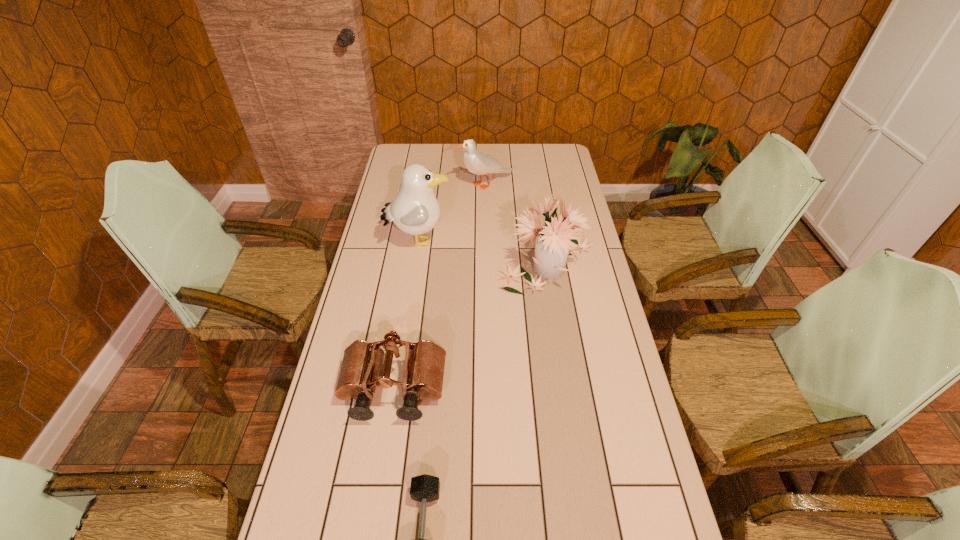
Locate an element on the screen. This screenshot has height=540, width=960. the nearer gull is located at coordinates (415, 210).

Identify the location of the taller gull. The image size is (960, 540). (415, 210).

Locate an element on the screen. bouquet is located at coordinates (553, 239).

Find the location of a particular element. The height and width of the screenshot is (540, 960). the farthest object is located at coordinates (476, 162).

This screenshot has height=540, width=960. Find the location of `the right gull`. the right gull is located at coordinates pyautogui.click(x=476, y=162).

I want to click on the fourth tallest object, so click(x=424, y=364).

Identify the location of binoculars. The width and height of the screenshot is (960, 540). (424, 364).

You are a GUI agent. You are given a task and a screenshot of the screen. Output one action in this format:
    pyautogui.click(x=<x>, y=<y>)
    Task: Click on the vacant region located on the beak of the left gull
    The image size is (960, 540).
    Given the screenshot: What is the action you would take?
    pyautogui.click(x=480, y=240)

Locate an element on the screen. This screenshot has width=960, height=540. vacant space situated 0.270m on the back of the bouquet is located at coordinates (536, 192).

In order to click on vacant region located 0.220m at the beak of the third shortest object in this screenshot , I will do `click(410, 185)`.